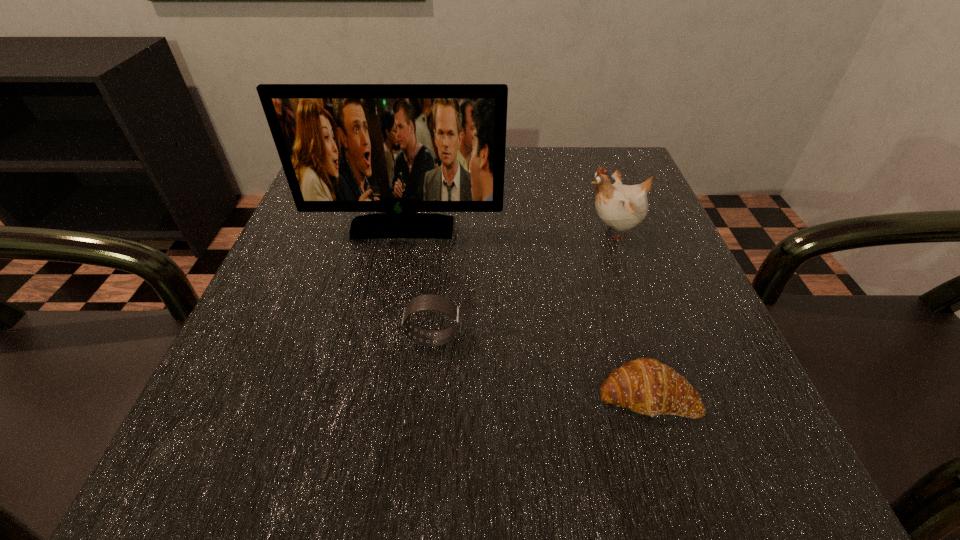
You are a GUI agent. You are given a task and a screenshot of the screen. Output one action in this format:
    pyautogui.click(x=<x>, y=<y>)
    Task: Click on the vacant space located on the face of the watch
    
    Given the screenshot: What is the action you would take?
    pyautogui.click(x=501, y=339)

The height and width of the screenshot is (540, 960). What are the coordinates of `free space located on the back of the crescent roll` in the screenshot? It's located at (603, 250).

Locate an element on the screen. This screenshot has width=960, height=540. object located in the left edge section of the desktop is located at coordinates (399, 149).

Identify the location of bird situated at the right edge. (622, 207).

This screenshot has width=960, height=540. Find the location of `crescent roll situated at the right edge`. crescent roll situated at the right edge is located at coordinates (646, 386).

I want to click on vacant space at the far edge of the desktop, so click(x=507, y=200).

The image size is (960, 540). In the image, there is a desktop. Find the location of `vacant space at the left edge`. vacant space at the left edge is located at coordinates (337, 348).

Identify the location of vacant space at the right edge of the desktop. (639, 292).

At what (x,y) coordinates should I click in order to perform the action: click on vacant region between the third tallest object and the monitor. Please return your answer as a coordinate pair (x, y). Looking at the image, I should click on (419, 284).

I want to click on vacant point located between the third shortest object and the shortest object, so click(x=630, y=313).